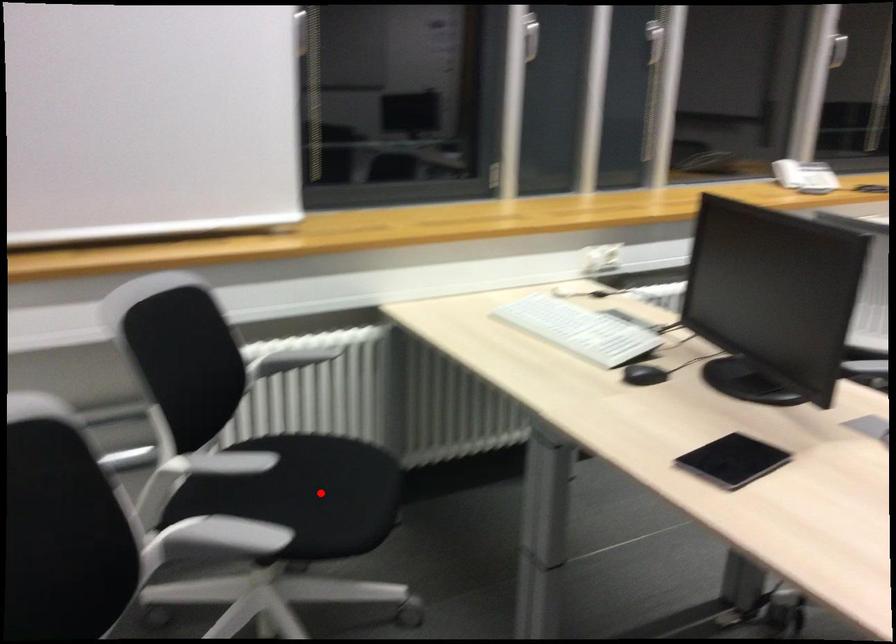
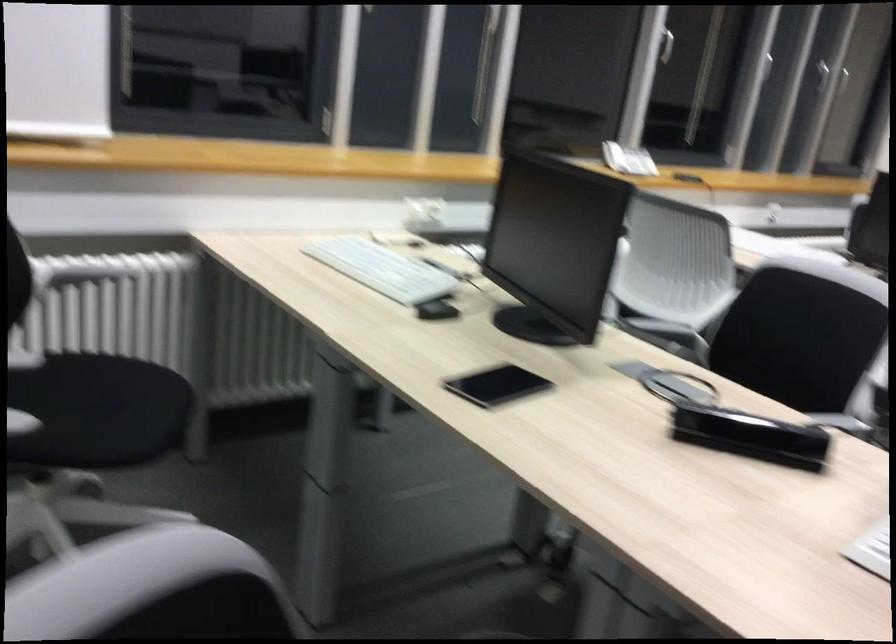
In the second image, find the point that corresponds to the highlighted location in the first image.

(101, 410)